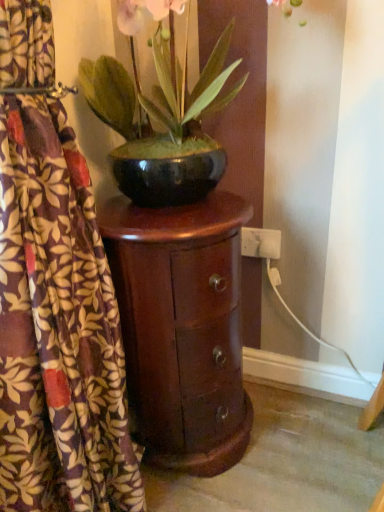
Where is `glossy wood nightstand at left`? This screenshot has width=384, height=512. glossy wood nightstand at left is located at coordinates (182, 327).

Describe the element at coordinates (58, 328) in the screenshot. The width and height of the screenshot is (384, 512). I see `printed fabric curtain at left` at that location.

Find the location of a particular element. white plastic electric outlet at lower right is located at coordinates (260, 243).

Which of these two, white plastic electric outlet at lower right or printed fabric curtain at left, stands taller?

printed fabric curtain at left is taller.

Consider the image. Is white plastic electric outlet at lower right directly adjacent to printed fabric curtain at left?

No, white plastic electric outlet at lower right is not next to printed fabric curtain at left.

Considering the sizes of objects white plastic electric outlet at lower right and printed fabric curtain at left in the image provided, who is bigger, white plastic electric outlet at lower right or printed fabric curtain at left?

With larger size is printed fabric curtain at left.

From the image's perspective, would you say white plastic electric outlet at lower right is shown under printed fabric curtain at left?

No, from the image's perspective, white plastic electric outlet at lower right is not beneath printed fabric curtain at left.

Considering the sizes of objects green glossy bowl at center and printed fabric curtain at left in the image provided, who is thinner, green glossy bowl at center or printed fabric curtain at left?

Thinner between the two is printed fabric curtain at left.

Who is shorter, green glossy bowl at center or printed fabric curtain at left?

With less height is green glossy bowl at center.

Is green glossy bowl at center in contact with printed fabric curtain at left?

They are not placed beside each other.

Considering the relative positions of green glossy bowl at center and printed fabric curtain at left in the image provided, is green glossy bowl at center to the left or to the right of printed fabric curtain at left?

Based on their positions, green glossy bowl at center is located to the right of printed fabric curtain at left.

Does point (63, 394) come farther from viewer compared to point (107, 109)?

No, it is not.

Considering the relative sizes of printed fabric curtain at left and green glossy bowl at center in the image provided, is printed fabric curtain at left smaller than green glossy bowl at center?

No.

What's the angular difference between printed fabric curtain at left and green glossy bowl at center's facing directions?

The angular difference between printed fabric curtain at left and green glossy bowl at center is 2.73 degrees.

Would you consider printed fabric curtain at left to be distant from green glossy bowl at center?

They are positioned close to each other.

How far apart are white plastic electric outlet at lower right and green glossy bowl at center?

The distance of white plastic electric outlet at lower right from green glossy bowl at center is 16.17 inches.

Is point (276, 241) positioned behind point (146, 148)?

Yes, it is behind point (146, 148).

From the picture: Is green glossy bowl at center a part of white plastic electric outlet at lower right?

No, green glossy bowl at center is not inside white plastic electric outlet at lower right.

Which object is more forward, white plastic electric outlet at lower right or green glossy bowl at center?

green glossy bowl at center is in front.

From the image's perspective, which object appears higher, green glossy bowl at center or glossy wood nightstand at left?

green glossy bowl at center.

Can glossy wood nightstand at left be found inside green glossy bowl at center?

That's incorrect, glossy wood nightstand at left is not inside green glossy bowl at center.

Relative to glossy wood nightstand at left, is green glossy bowl at center in front or behind?

In the image, green glossy bowl at center appears in front of glossy wood nightstand at left.

Is green glossy bowl at center to the left or to the right of glossy wood nightstand at left in the image?

In the image, green glossy bowl at center appears on the right side of glossy wood nightstand at left.

From the image's perspective, relative to white plastic electric outlet at lower right, is green glossy bowl at center above or below?

green glossy bowl at center is above white plastic electric outlet at lower right.

Is green glossy bowl at center smaller than white plastic electric outlet at lower right?

Incorrect, green glossy bowl at center is not smaller in size than white plastic electric outlet at lower right.

Considering the relative positions of green glossy bowl at center and white plastic electric outlet at lower right in the image provided, is green glossy bowl at center to the left of white plastic electric outlet at lower right from the viewer's perspective?

Indeed, green glossy bowl at center is positioned on the left side of white plastic electric outlet at lower right.

Which of these two, printed fabric curtain at left or glossy wood nightstand at left, is bigger?

Bigger between the two is printed fabric curtain at left.

Which of these two, printed fabric curtain at left or glossy wood nightstand at left, is wider?

With larger width is glossy wood nightstand at left.

Consider the image. Can you tell me how much printed fabric curtain at left and glossy wood nightstand at left differ in facing direction?

3.88 degrees separate the facing orientations of printed fabric curtain at left and glossy wood nightstand at left.

From a real-world perspective, relative to glossy wood nightstand at left, is printed fabric curtain at left vertically above or below?

printed fabric curtain at left is situated higher than glossy wood nightstand at left in the real world.

In the image, there is a printed fabric curtain at left. At what (x,y) coordinates should I click in order to perform the action: click on electric outlet below it (from a real-world perspective). Please return your answer as a coordinate pair (x, y). This screenshot has height=512, width=384. Looking at the image, I should click on (260, 243).

This screenshot has width=384, height=512. There is a printed fabric curtain at left. What are the coordinates of `houseplant above it (from a real-world perspective)` in the screenshot? It's located at (162, 122).

Estimate the real-world distances between objects in this image. Which object is closer to printed fabric curtain at left, white plastic electric outlet at lower right or glossy wood nightstand at left?

glossy wood nightstand at left.

Looking at the image, which one is located closer to white plastic electric outlet at lower right, glossy wood nightstand at left or green glossy bowl at center?

glossy wood nightstand at left is closer to white plastic electric outlet at lower right.

Based on their spatial positions, is green glossy bowl at center or white plastic electric outlet at lower right further from glossy wood nightstand at left?

white plastic electric outlet at lower right is positioned further to the anchor glossy wood nightstand at left.

In the scene shown: Estimate the real-world distances between objects in this image. Which object is closer to green glossy bowl at center, printed fabric curtain at left or glossy wood nightstand at left?

The object closer to green glossy bowl at center is glossy wood nightstand at left.

In the scene shown: Based on their spatial positions, is glossy wood nightstand at left or white plastic electric outlet at lower right further from green glossy bowl at center?

white plastic electric outlet at lower right.

Estimate the real-world distances between objects in this image. Which object is further from white plastic electric outlet at lower right, printed fabric curtain at left or glossy wood nightstand at left?

The object further to white plastic electric outlet at lower right is printed fabric curtain at left.

From the image, which object appears to be farther from white plastic electric outlet at lower right, green glossy bowl at center or printed fabric curtain at left?

printed fabric curtain at left is positioned further to the anchor white plastic electric outlet at lower right.

Which object lies further to the anchor point printed fabric curtain at left, glossy wood nightstand at left or green glossy bowl at center?

Based on the image, green glossy bowl at center appears to be further to printed fabric curtain at left.

The image size is (384, 512). Identify the location of houseplant located between printed fabric curtain at left and white plastic electric outlet at lower right in the depth direction. (162, 122).

This screenshot has height=512, width=384. What are the coordinates of `curtain between green glossy bowl at center and glossy wood nightstand at left in the up-down direction` in the screenshot? It's located at (58, 328).

I want to click on nightstand located between green glossy bowl at center and white plastic electric outlet at lower right in the depth direction, so click(182, 327).

I want to click on nightstand positioned between printed fabric curtain at left and white plastic electric outlet at lower right from near to far, so click(182, 327).